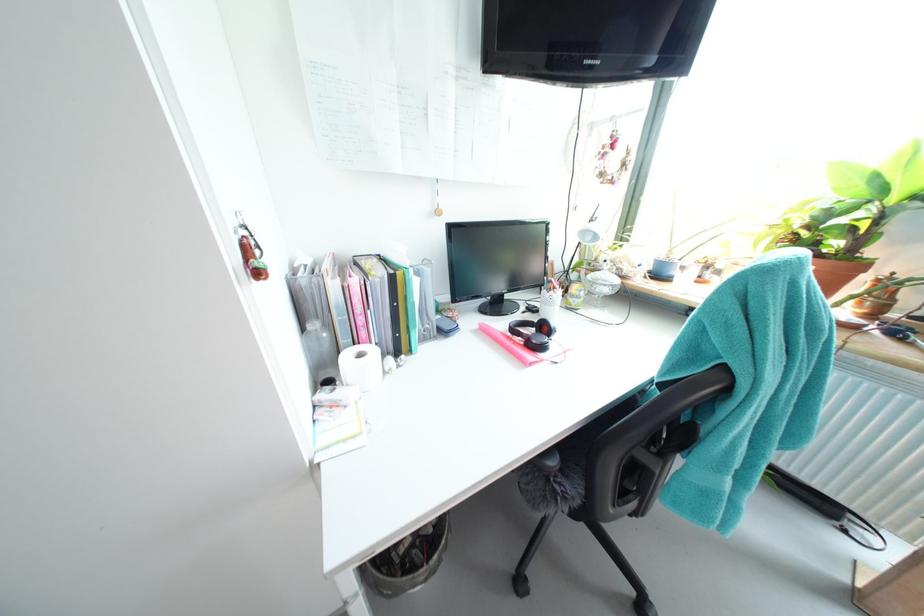
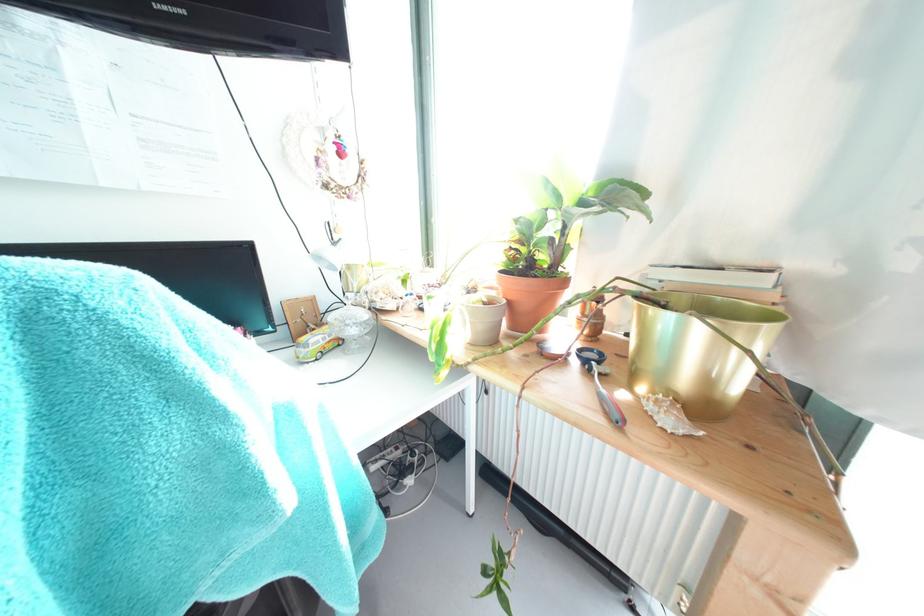
Find the pixel in the second image that matches [581,306] in the first image.

(309, 358)